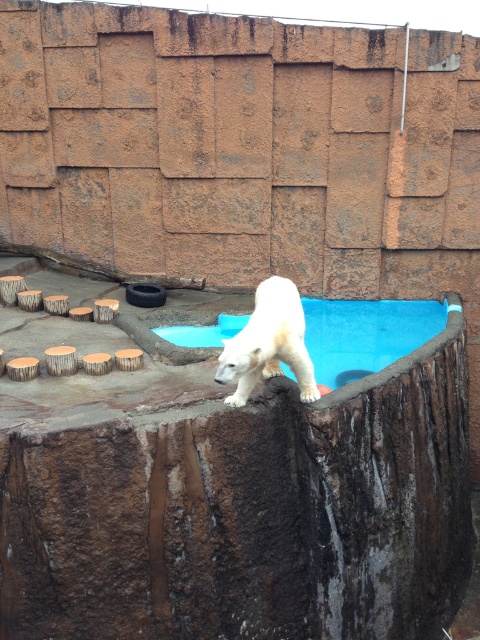
You are a zookeeper planning to clean the enclosure. You need to know if the blue smooth water at upper center is wider than the white fur bear at center to determine the cleaning equipment needed. Can you confirm this?

The blue smooth water at upper center is wider than the white fur bear at center, so the cleaning equipment should be adjusted accordingly to accommodate the larger width of the blue smooth water at upper center.

You are a zookeeper planning to feed the white fur bear at center. The food needs to be placed on the ground near the blue smooth water at upper center. Considering the height difference between them, will the food be visible to the bear from its current position?

The blue smooth water at upper center is taller than the white fur bear at center, so the bear may not be able to see the food placed near the water due to the height obstruction.

From the picture: You are a zookeeper observing the polar bear in the enclosure. You notice the blue smooth water at upper center and the white fur bear at center. Which object is located above the other?

The blue smooth water at upper center is positioned over the white fur bear at center, so the water is above the bear.